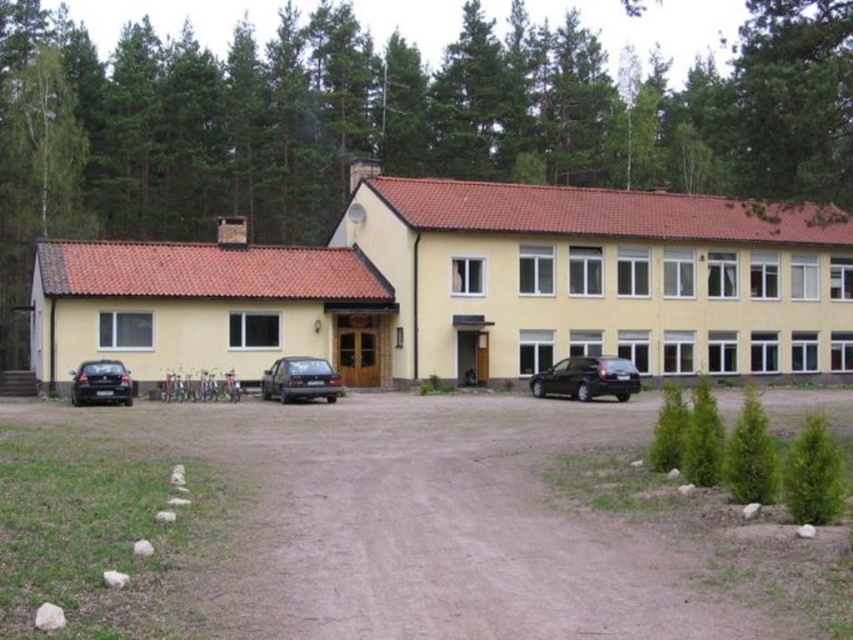
Question: Based on their relative distances, which object is nearer to the shiny black car at lower left?

Choices:
 (A) black matte car at center
 (B) satin black hatchback at center

Answer: (B)

Question: Which of the following is the farthest from the observer?

Choices:
 (A) black matte car at center
 (B) satin black hatchback at center
 (C) shiny black car at lower left

Answer: (A)

Question: Does black matte car at center come behind shiny black car at lower left?

Choices:
 (A) yes
 (B) no

Answer: (A)

Question: Is black matte car at center below shiny black car at lower left?

Choices:
 (A) yes
 (B) no

Answer: (B)

Question: Considering the relative positions of satin black hatchback at center and shiny black car at lower left in the image provided, where is satin black hatchback at center located with respect to shiny black car at lower left?

Choices:
 (A) above
 (B) below

Answer: (A)

Question: Which of these objects is positioned closest to the shiny black car at lower left?

Choices:
 (A) satin black hatchback at center
 (B) black matte car at center

Answer: (A)